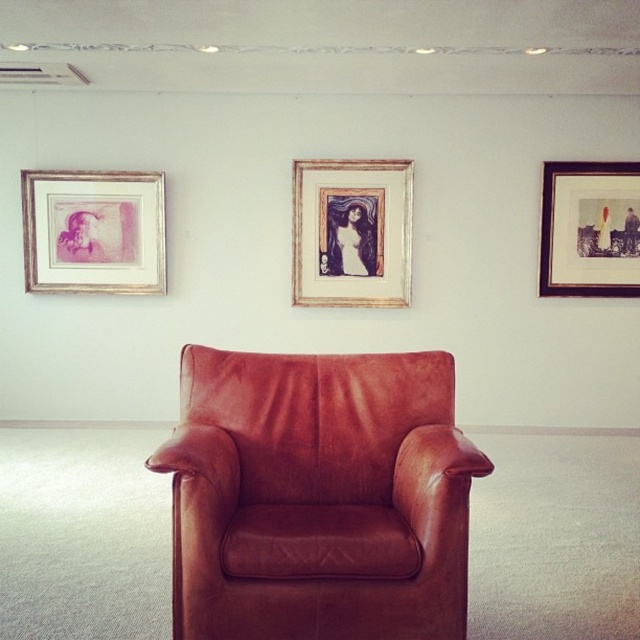
This screenshot has height=640, width=640. What do you see at coordinates (93, 230) in the screenshot? I see `matte pink paper at left` at bounding box center [93, 230].

I want to click on matte pink paper at left, so click(x=93, y=230).

Who is shorter, wooden frame at center or wooden picture frame at upper right?

wooden picture frame at upper right is shorter.

Between wooden frame at center and wooden picture frame at upper right, which one appears on the left side from the viewer's perspective?

From the viewer's perspective, wooden frame at center appears more on the left side.

Which is behind, point (358, 260) or point (541, 208)?

The point (358, 260) is more distant.

This screenshot has width=640, height=640. I want to click on wooden frame at center, so click(x=352, y=232).

Does point (376, 417) come behind point (76, 259)?

No, (376, 417) is closer to viewer.

Does brown leather armchair at center have a greater height compared to matte pink paper at left?

Yes.

Measure the distance between brown leather armchair at center and camera.

brown leather armchair at center and camera are 2.09 meters apart.

Where is `brown leather armchair at center`? This screenshot has width=640, height=640. brown leather armchair at center is located at coordinates (317, 497).